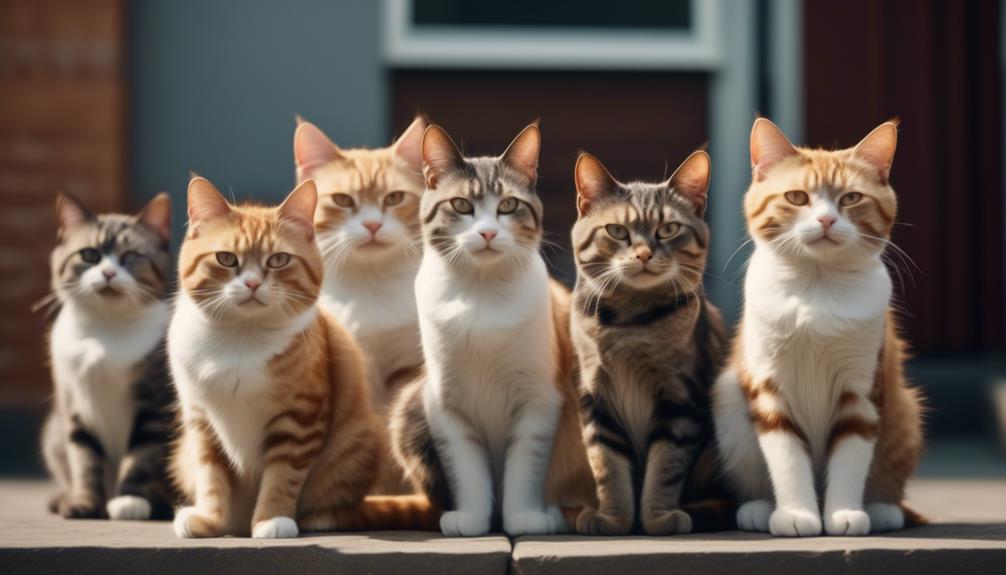
Locate an element on the screen. chests is located at coordinates (242, 366), (93, 348), (369, 308), (481, 315), (630, 343), (812, 322).